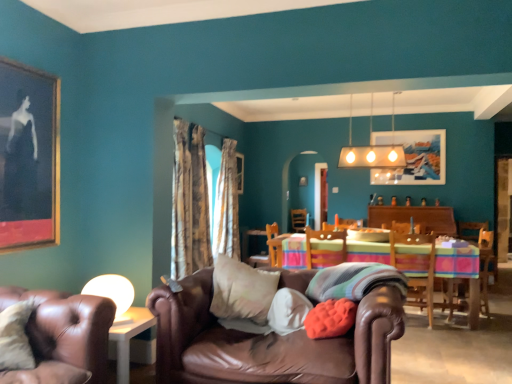
Question: Is white soft pillow at center, the 3th pillow viewed from the right, behind silky white curtain at center, the first curtain when ordered from right to left?

Choices:
 (A) no
 (B) yes

Answer: (A)

Question: Is white soft pillow at center, the 3th pillow viewed from the right, closer to the viewer compared to silky white curtain at center, which is counted as the first curtain, starting from the back?

Choices:
 (A) no
 (B) yes

Answer: (B)

Question: Does white soft pillow at center, which ranks as the 2th pillow in left-to-right order, have a lesser width compared to silky white curtain at center, the first curtain when ordered from right to left?

Choices:
 (A) yes
 (B) no

Answer: (A)

Question: Considering the relative sizes of white soft pillow at center, the 3th pillow viewed from the right, and silky white curtain at center, the first curtain when ordered from right to left, in the image provided, is white soft pillow at center, the 3th pillow viewed from the right, wider than silky white curtain at center, the first curtain when ordered from right to left,?

Choices:
 (A) yes
 (B) no

Answer: (B)

Question: Is white soft pillow at center, which ranks as the 2th pillow in left-to-right order, taller than silky white curtain at center, the first curtain when ordered from right to left?

Choices:
 (A) yes
 (B) no

Answer: (B)

Question: Does white soft pillow at center, which ranks as the 2th pillow in left-to-right order, turn towards silky white curtain at center, arranged as the second curtain when viewed from the left?

Choices:
 (A) no
 (B) yes

Answer: (A)

Question: Is silky white curtain at center, the first curtain when ordered from right to left, turned away from multicolored woven tablecloth at center?

Choices:
 (A) no
 (B) yes

Answer: (A)

Question: Does silky white curtain at center, positioned as the 2th curtain in front-to-back order, have a greater width compared to multicolored woven tablecloth at center?

Choices:
 (A) no
 (B) yes

Answer: (A)

Question: Considering the relative sizes of silky white curtain at center, arranged as the second curtain when viewed from the left, and multicolored woven tablecloth at center in the image provided, is silky white curtain at center, arranged as the second curtain when viewed from the left, shorter than multicolored woven tablecloth at center?

Choices:
 (A) no
 (B) yes

Answer: (A)

Question: From a real-world perspective, does silky white curtain at center, positioned as the 2th curtain in front-to-back order, sit lower than multicolored woven tablecloth at center?

Choices:
 (A) no
 (B) yes

Answer: (A)

Question: Is silky white curtain at center, which is counted as the first curtain, starting from the back, positioned before multicolored woven tablecloth at center?

Choices:
 (A) no
 (B) yes

Answer: (A)

Question: Can you confirm if brown leather couch at lower left, the 1th chair viewed from the front, is bigger than wooden framed artwork at upper center, which ranks as the 3th picture frame in left-to-right order?

Choices:
 (A) yes
 (B) no

Answer: (A)